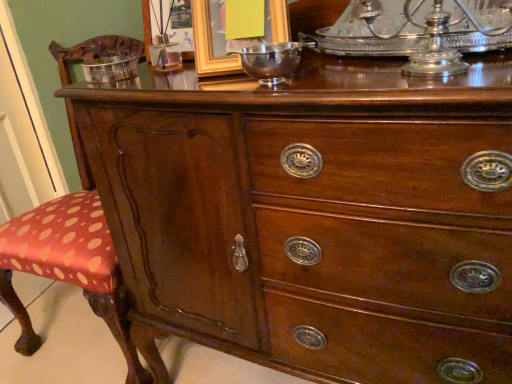
Question: Considering the relative positions of shiny silver bowl at center and silver metallic bowl at upper left in the image provided, is shiny silver bowl at center in front of silver metallic bowl at upper left?

Choices:
 (A) yes
 (B) no

Answer: (A)

Question: Does shiny silver bowl at center touch silver metallic bowl at upper left?

Choices:
 (A) yes
 (B) no

Answer: (B)

Question: From a real-world perspective, is shiny silver bowl at center under silver metallic bowl at upper left?

Choices:
 (A) yes
 (B) no

Answer: (B)

Question: Considering the relative positions of shiny silver bowl at center and silver metallic bowl at upper left in the image provided, is shiny silver bowl at center to the right of silver metallic bowl at upper left from the viewer's perspective?

Choices:
 (A) no
 (B) yes

Answer: (B)

Question: Is there a large distance between shiny silver bowl at center and silver metallic bowl at upper left?

Choices:
 (A) yes
 (B) no

Answer: (B)

Question: Is point (155, 33) positioned closer to the camera than point (230, 72)?

Choices:
 (A) farther
 (B) closer

Answer: (A)

Question: Choose the correct answer: Is metallic gold picture frame at upper center, the second picture frame from the right, inside gold metallic picture frame at upper center, acting as the 2th picture frame starting from the left, or outside it?

Choices:
 (A) outside
 (B) inside

Answer: (A)

Question: From a real-world perspective, relative to gold metallic picture frame at upper center, acting as the 2th picture frame starting from the left, is metallic gold picture frame at upper center, which is the first picture frame in left-to-right order, vertically above or below?

Choices:
 (A) above
 (B) below

Answer: (B)

Question: Is metallic gold picture frame at upper center, the second picture frame from the right, in front of or behind gold metallic picture frame at upper center, acting as the 2th picture frame starting from the left, in the image?

Choices:
 (A) behind
 (B) front

Answer: (A)

Question: Do you think gold metallic picture frame at upper center, arranged as the 1th picture frame when viewed from the right, is within metallic gold picture frame at upper center, which is the first picture frame in left-to-right order, or outside of it?

Choices:
 (A) outside
 (B) inside

Answer: (A)

Question: Considering the positions of gold metallic picture frame at upper center, acting as the 2th picture frame starting from the left, and metallic gold picture frame at upper center, the second picture frame from the right, in the image, is gold metallic picture frame at upper center, acting as the 2th picture frame starting from the left, bigger or smaller than metallic gold picture frame at upper center, the second picture frame from the right,?

Choices:
 (A) big
 (B) small

Answer: (A)

Question: Would you say gold metallic picture frame at upper center, arranged as the 1th picture frame when viewed from the right, is to the left or to the right of metallic gold picture frame at upper center, the second picture frame from the right, in the picture?

Choices:
 (A) right
 (B) left

Answer: (A)

Question: Is point (211, 71) positioned closer to the camera than point (144, 26)?

Choices:
 (A) closer
 (B) farther

Answer: (A)

Question: From a real-world perspective, is gold metallic picture frame at upper center, arranged as the 1th picture frame when viewed from the right, above or below silver metallic bowl at upper left?

Choices:
 (A) below
 (B) above

Answer: (B)

Question: Is gold metallic picture frame at upper center, arranged as the 1th picture frame when viewed from the right, situated inside silver metallic bowl at upper left or outside?

Choices:
 (A) outside
 (B) inside

Answer: (A)